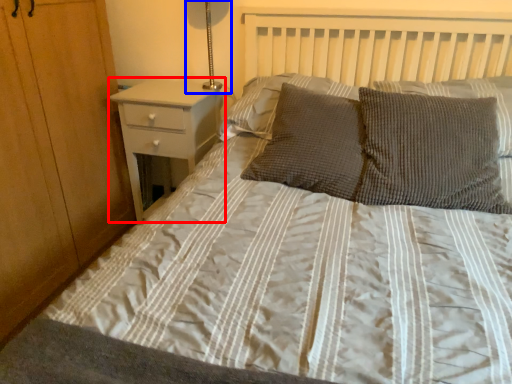
Question: Which object appears farthest to the camera in this image, nightstand (highlighted by a red box) or bedside lamp (highlighted by a blue box)?

Choices:
 (A) nightstand
 (B) bedside lamp

Answer: (A)